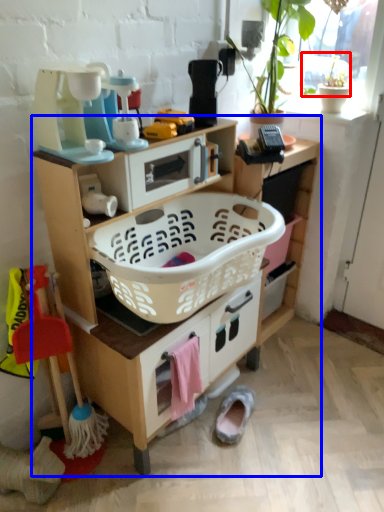
Question: Which of the following is the farthest to the observer, plant (highlighted by a red box) or shelf (highlighted by a blue box)?

Choices:
 (A) plant
 (B) shelf

Answer: (A)